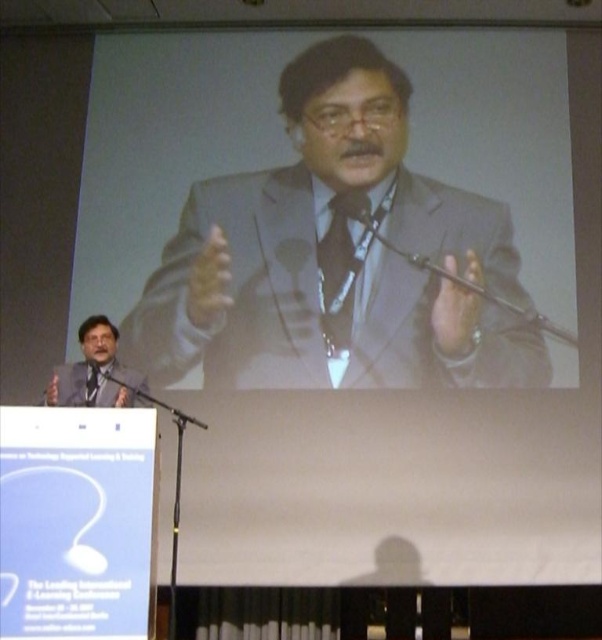
Question: Which of the following is the closest to the observer?

Choices:
 (A) (243, 234)
 (B) (98, 369)
 (C) (329, 262)

Answer: (B)

Question: Which point is farther to the camera?

Choices:
 (A) matte black suit at lower left
 (B) matte black tie at center

Answer: (B)

Question: Can you confirm if matte gray suit at center is bigger than matte black suit at lower left?

Choices:
 (A) yes
 (B) no

Answer: (A)

Question: Which of these objects is positioned closest to the matte black suit at lower left?

Choices:
 (A) matte black tie at center
 (B) matte gray suit at center

Answer: (B)

Question: Is matte gray suit at center positioned behind black matte microphone at lower left?

Choices:
 (A) no
 (B) yes

Answer: (B)

Question: Is matte black suit at lower left to the right of black matte microphone at lower left from the viewer's perspective?

Choices:
 (A) no
 (B) yes

Answer: (A)